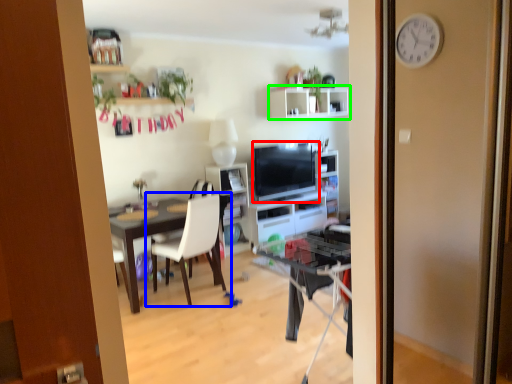
Question: Considering the real-world distances, which object is farthest from television (highlighted by a red box)? chair (highlighted by a blue box) or shelf (highlighted by a green box)?

Choices:
 (A) chair
 (B) shelf

Answer: (A)